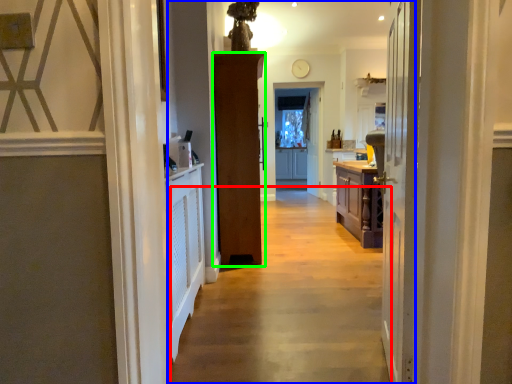
Question: Estimate the real-world distances between objects in this image. Which object is closer to path (highlighted by a red box), corridor (highlighted by a blue box) or door (highlighted by a green box)?

Choices:
 (A) corridor
 (B) door

Answer: (B)